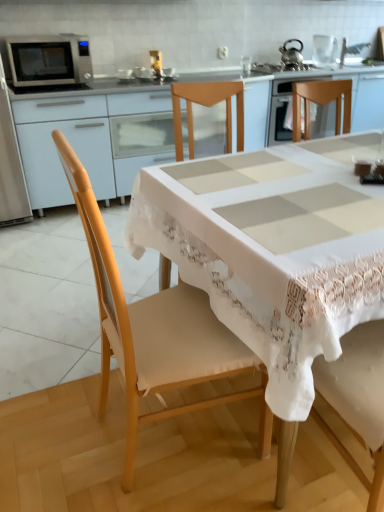
Find the location of a particular element. This screenshot has height=512, width=384. vacant region to the left of wooden chair at center is located at coordinates (61, 422).